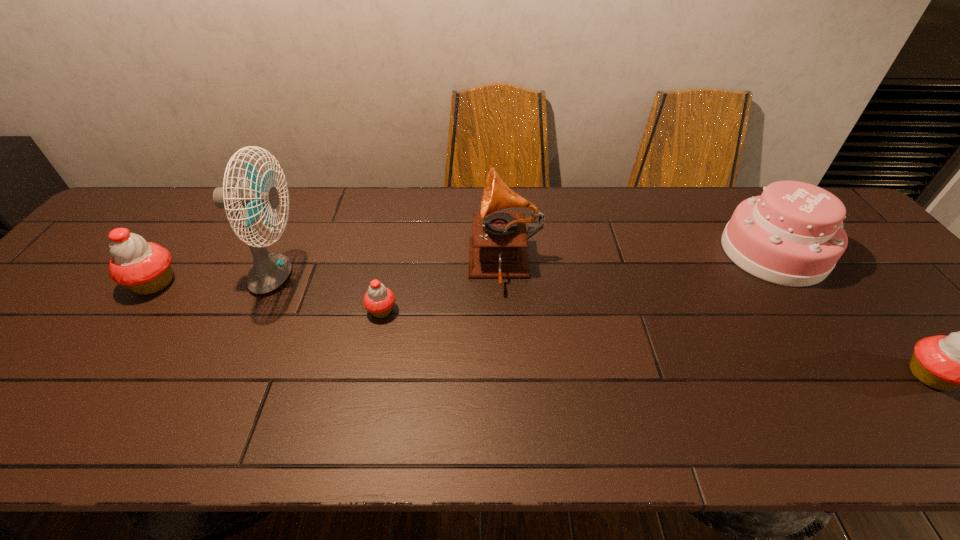
If we want them evenly spaced by inserting an extra cupcake among them, please locate a free spot for this new cupcake. Please provide its 2D coordinates. Your answer should be formatted as a tuple, i.e. [(x, y)], where the tuple contains the x and y coordinates of a point satisfying the conditions above.

[(638, 341)]